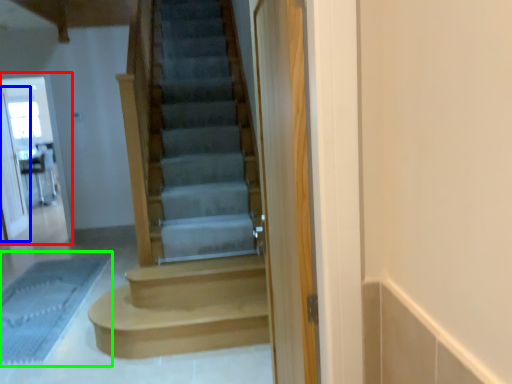
Question: Which object is positioned farthest from screen door (highlighted by a red box)? Select from screen door (highlighted by a blue box) and bath mat (highlighted by a green box).

Choices:
 (A) screen door
 (B) bath mat

Answer: (B)